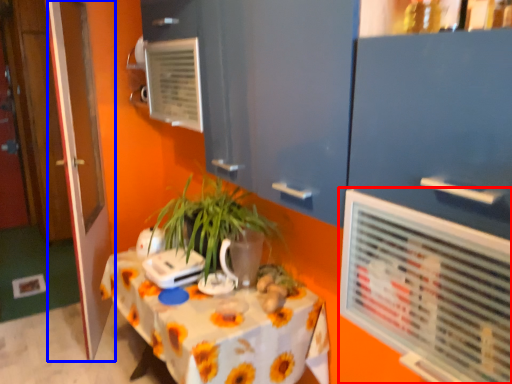
Question: Among these objects, which one is farthest to the camera, air conditioning (highlighted by a red box) or door (highlighted by a blue box)?

Choices:
 (A) air conditioning
 (B) door

Answer: (B)